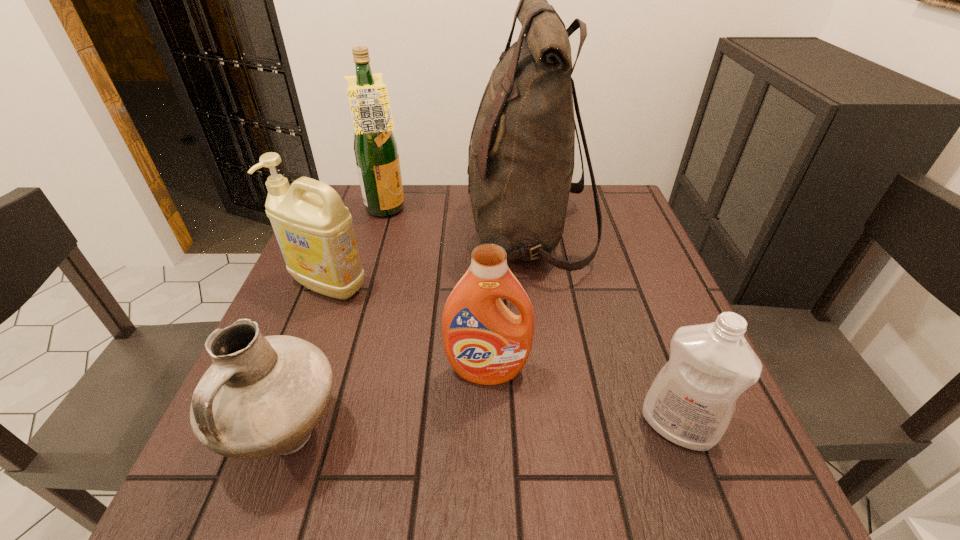
Locate an element on the screen. vacant space at the near left corner of the desktop is located at coordinates (279, 511).

The image size is (960, 540). Identify the location of vacant space at the far right corner of the desktop. (628, 197).

In the image, there is a desktop. Where is `free space at the near right corner`? free space at the near right corner is located at coordinates (665, 490).

Find the location of a particular element. This screenshot has height=540, width=960. vacant space that's between the fifth shortest object and the second nearest detergent is located at coordinates (437, 291).

This screenshot has width=960, height=540. I want to click on vacant region between the second detergent from right to left and the rightmost detergent, so click(583, 399).

Find the location of a particular element. vacant region between the second detergent from right to left and the pitcher is located at coordinates (387, 403).

This screenshot has width=960, height=540. Find the location of `unoccupied position between the fourth farthest object and the backpack`. unoccupied position between the fourth farthest object and the backpack is located at coordinates (508, 302).

Where is `free spot between the rightmost detergent and the pitcher`? Image resolution: width=960 pixels, height=540 pixels. free spot between the rightmost detergent and the pitcher is located at coordinates (482, 430).

The image size is (960, 540). I want to click on object that stands as the second closest to the leftmost detergent, so click(262, 396).

Identify which object is located as the fifth nearest to the pitcher. Please provide its 2D coordinates. Your answer should be formatted as a tuple, i.e. [(x, y)], where the tuple contains the x and y coordinates of a point satisfying the conditions above.

[(375, 147)]